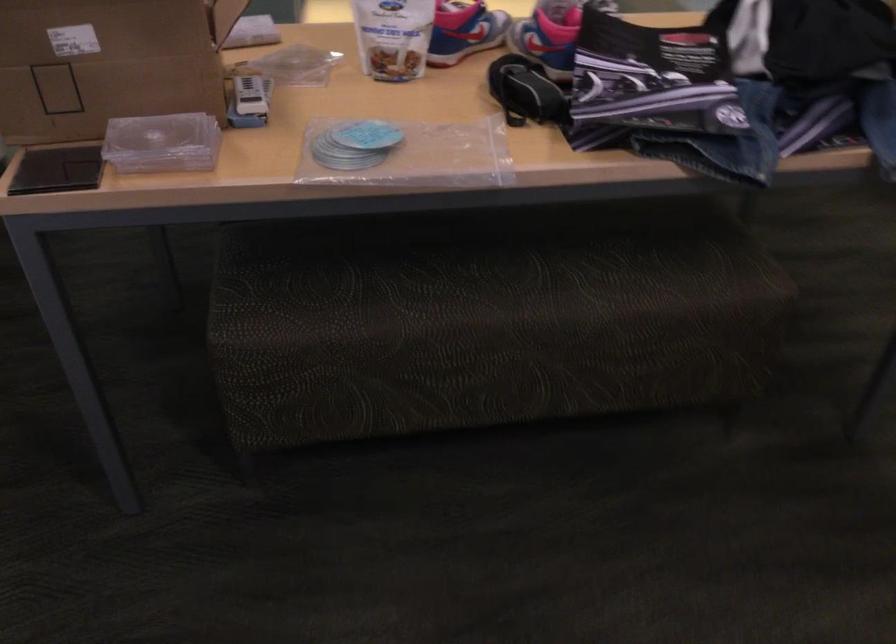
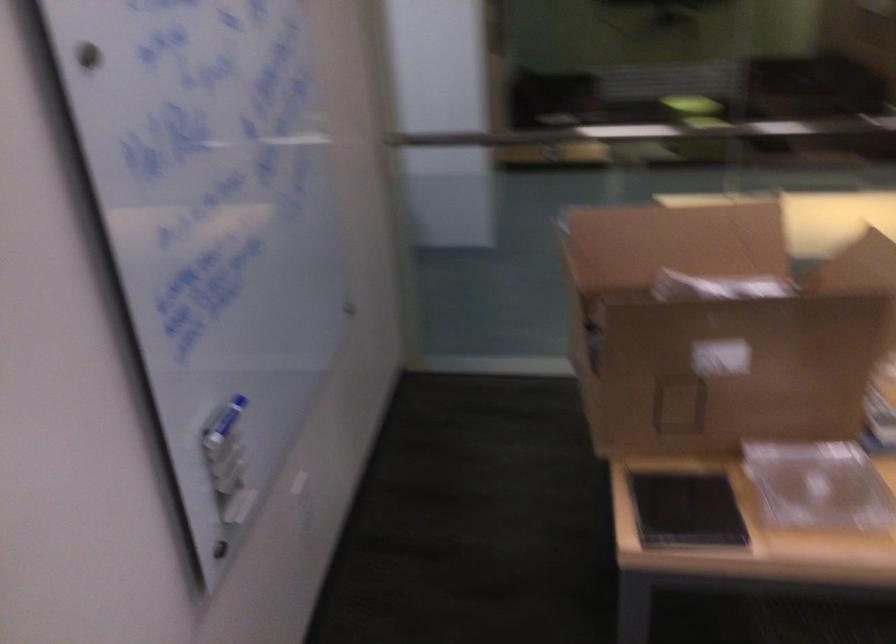
Question: The images are taken continuously from a first-person perspective. In which direction are you moving?

Choices:
 (A) Left
 (B) Right
 (C) Forward
 (D) Backward

Answer: (A)